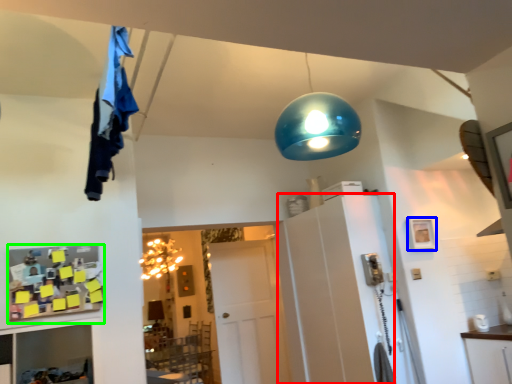
Question: Based on their relative distances, which object is nearer to cabinetry (highlighted by a red box)? Choose from picture frame (highlighted by a blue box) and shelf (highlighted by a green box).

Choices:
 (A) picture frame
 (B) shelf

Answer: (A)